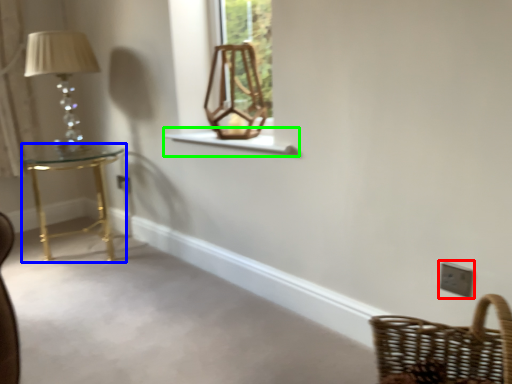
Question: Estimate the real-world distances between objects in this image. Which object is farther from light switch (highlighted by a red box), table (highlighted by a blue box) or window sill (highlighted by a green box)?

Choices:
 (A) table
 (B) window sill

Answer: (A)